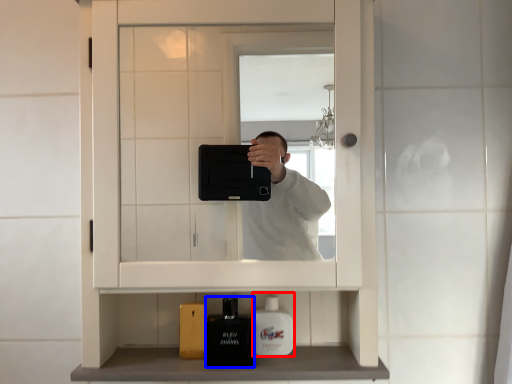
Question: Among these objects, which one is farthest to the camera, mouthwash (highlighted by a red box) or toiletry (highlighted by a blue box)?

Choices:
 (A) mouthwash
 (B) toiletry

Answer: (A)